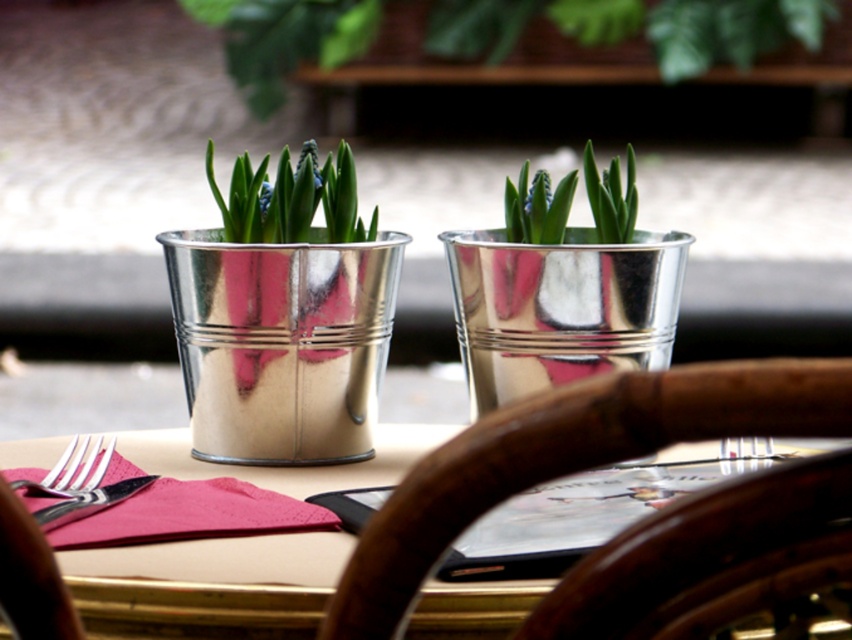
Where is `wooden chair back at center`? The height and width of the screenshot is (640, 852). wooden chair back at center is located at coordinates (568, 460).

Consider the image. Is wooden chair back at center wider than silver metallic fork at left?

Yes.

Measure the distance between point (753, 401) and camera.

They are 9.48 inches apart.

This screenshot has width=852, height=640. Identify the location of wooden chair back at center. (568, 460).

Does green leafy plant at upper center appear over silver metallic fork at left?

Indeed, green leafy plant at upper center is positioned over silver metallic fork at left.

Can you confirm if green leafy plant at upper center is smaller than silver metallic fork at left?

No, green leafy plant at upper center is not smaller than silver metallic fork at left.

Measure the distance between point [486,60] and camera.

A distance of 30.28 inches exists between point [486,60] and camera.

Identify the location of green leafy plant at upper center. This screenshot has height=640, width=852. [x=632, y=28].

At what (x,y) coordinates should I click in order to perform the action: click on metallic silver pot at center. Please return your answer as a coordinate pair (x, y). Image resolution: width=852 pixels, height=640 pixels. Looking at the image, I should click on (291, 198).

Does point (272, 189) lie in front of point (65, 493)?

No, (272, 189) is further to viewer.

The height and width of the screenshot is (640, 852). Identify the location of metallic silver pot at center. (291, 198).